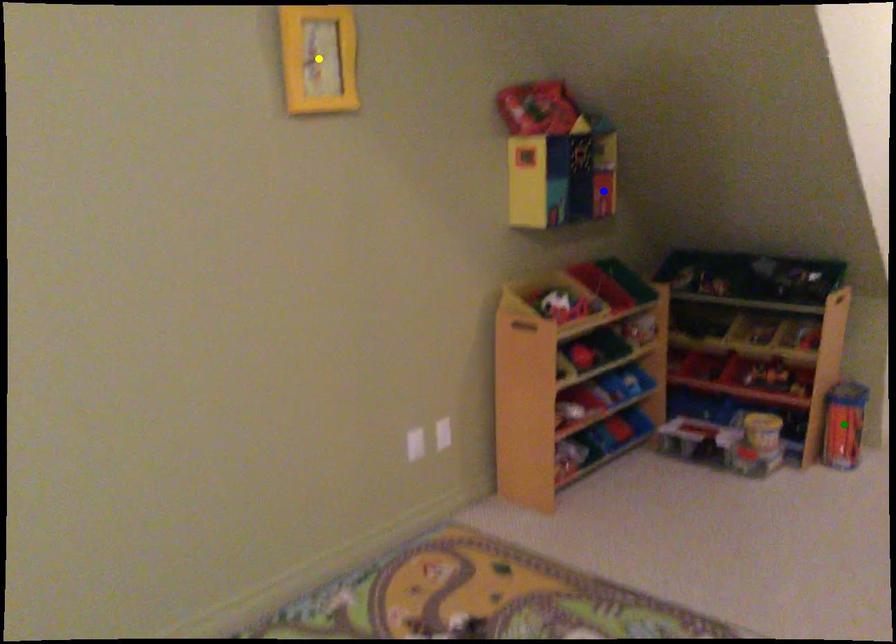
In the scene shown: Order these from farthest to nearest:
1. green point
2. yellow point
3. blue point

blue point
green point
yellow point